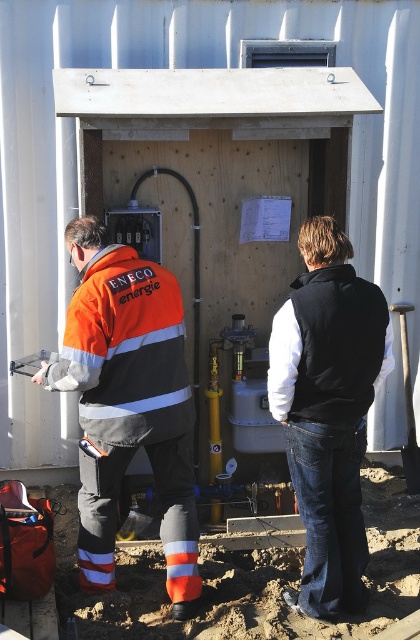
You are a safety inspector assessing the work site. You notice the orange reflective jacket at center and the black fleece vest at center. According to safety protocols, which clothing item should be visible first from above? Explain your reasoning based on their positions.

The orange reflective jacket at center should be visible first from above because it is located above the black fleece vest at center, making it more prominent in an aerial view.

Looking at this image, you are a safety inspector checking the workspace. You notice the orange reflective jacket at center and the black fleece vest at center. Which clothing item is wider in terms of its physical dimensions?

The orange reflective jacket at center is wider than the black fleece vest at center according to the description.